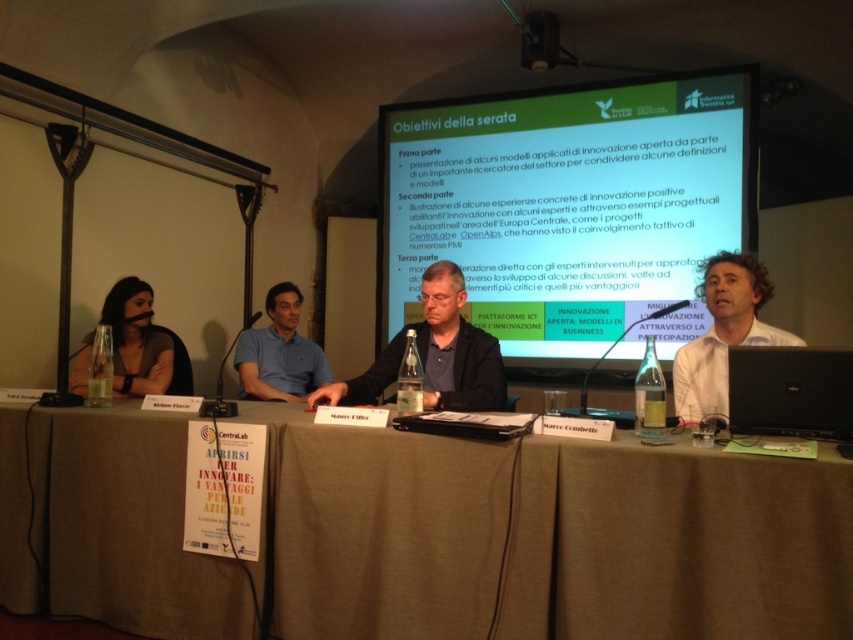
You are sitting in the audience and want to see both the brown fabric table at lower center and the green matte projector screen at upper center clearly. Which one is closer to you?

The brown fabric table at lower center is closer to you because it is in front of the green matte projector screen at upper center.

You are a photographer standing at the back of the room and want to capture a photo that includes both point (175, 605) and point (750, 104). Which point will appear larger in the photo?

Point (175, 605) is closer to the camera than point (750, 104), so it will appear larger in the photo.

You are setting up a presentation and need to place a 2.5 meter long extension cord from the green matte projector screen at upper center to the black matte laptop at lower right. Will the cord be long enough to reach without needing an extension?

The green matte projector screen at upper center is 2.12 meters away from the black matte laptop at lower right. The 2.5 meter extension cord is longer than the distance between them, so it will be sufficient to reach without needing an extension.